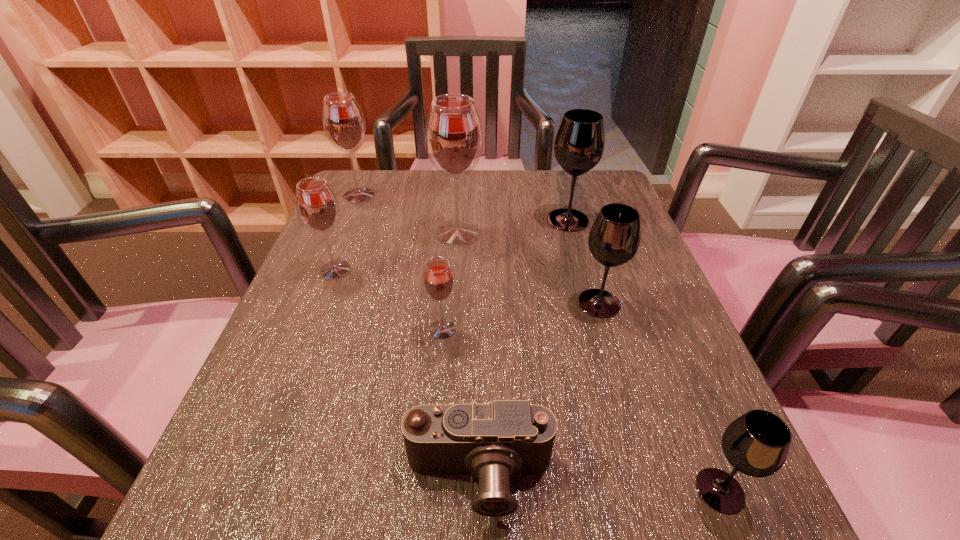
The height and width of the screenshot is (540, 960). What are the coordinates of `the rightmost wineglass` in the screenshot? It's located at click(757, 443).

Where is `camera`? camera is located at coordinates (507, 438).

You are a GUI agent. You are given a task and a screenshot of the screen. Output one action in this format:
    pyautogui.click(x=<x>, y=<y>)
    Task: Click on the vacant area situated on the front of the tallest wineglass
    This screenshot has width=960, height=540.
    Given the screenshot: What is the action you would take?
    pyautogui.click(x=455, y=275)

Find the location of a particular element. This screenshot has width=960, height=540. free space located 0.190m on the front of the farthest wineglass is located at coordinates (336, 251).

The image size is (960, 540). In order to click on free point located 0.150m on the front of the farthest gray wineglass in this screenshot , I will do `click(583, 274)`.

In order to click on vacant space located 0.260m on the back of the fourth farthest wineglass in this screenshot , I will do `click(363, 197)`.

Identify the location of vacant space situated 0.150m on the front of the second biggest gray wineglass. This screenshot has width=960, height=540. (623, 387).

You are a GUI agent. You are given a task and a screenshot of the screen. Output one action in this format:
    pyautogui.click(x=<x>, y=<y>)
    Task: Click on the blank area located 0.190m on the front of the nearest red wineglass
    The image size is (960, 540).
    Given the screenshot: What is the action you would take?
    pyautogui.click(x=433, y=442)

I want to click on free space located on the left of the nearest wineglass, so click(485, 490).

At what (x,y) coordinates should I click in order to perform the action: click on wineglass located at the near edge. Please return your answer as a coordinate pair (x, y). Image resolution: width=960 pixels, height=540 pixels. Looking at the image, I should click on (757, 443).